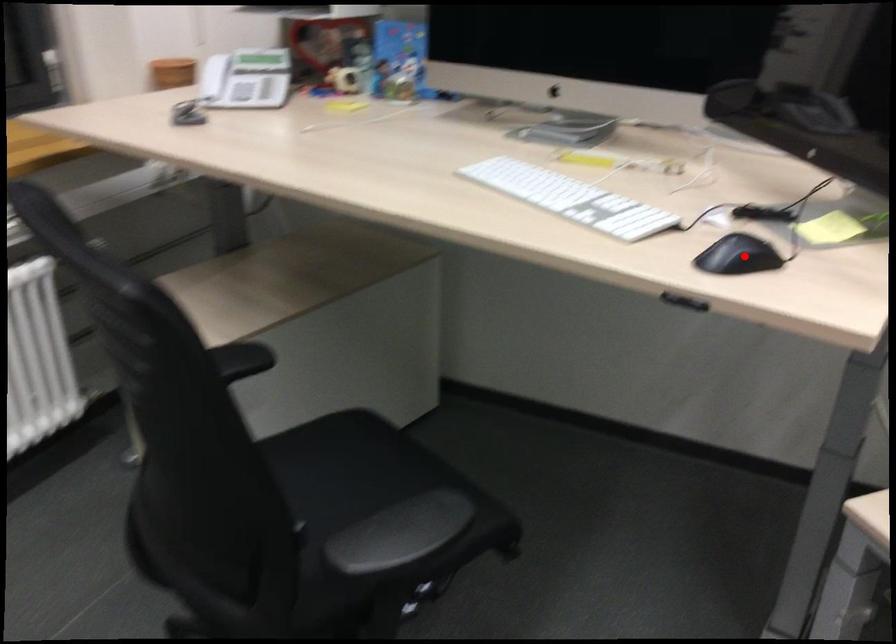
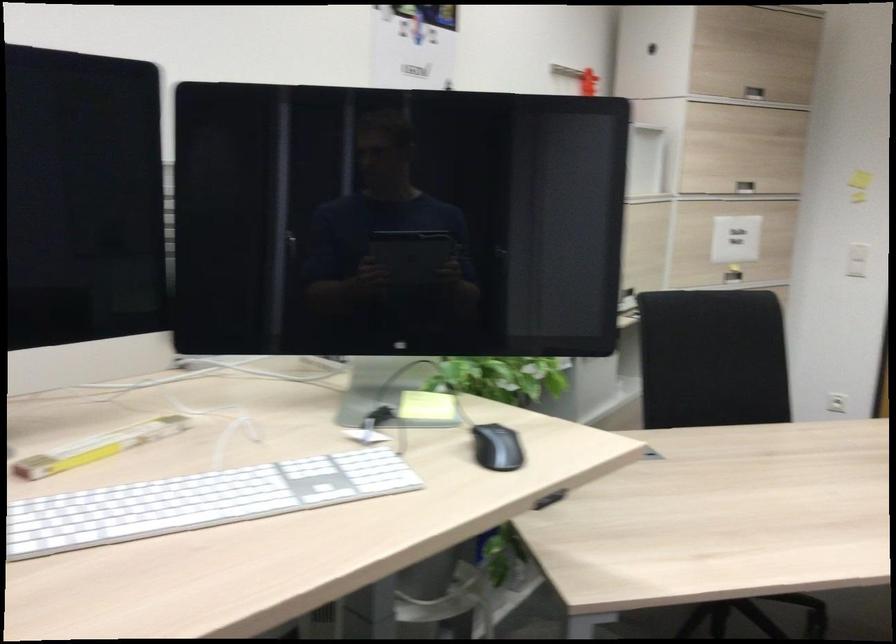
The point at the highlighted location is marked in the first image. Where is the corresponding point in the second image?

(496, 448)